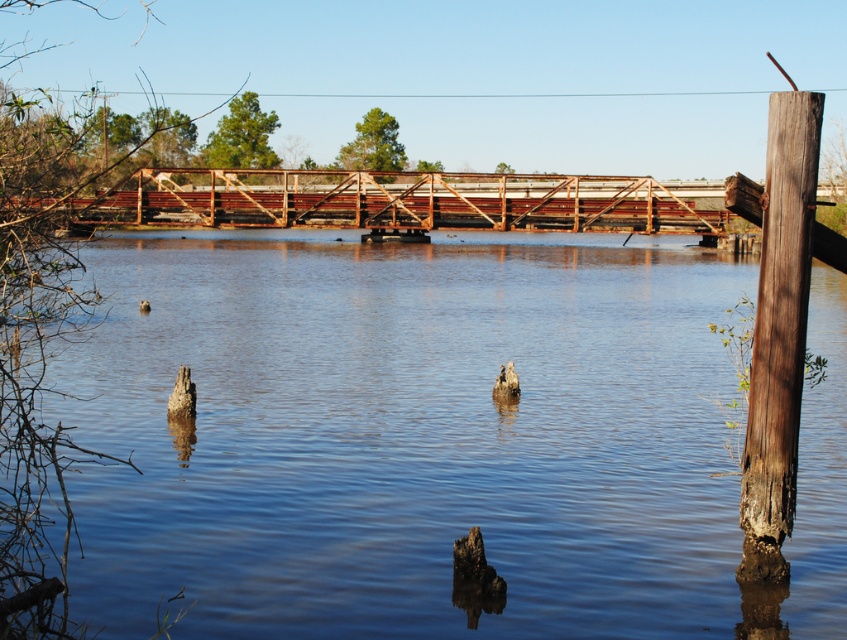
Question: Does blue water at center have a greater width compared to brown fuzzy duck at center?

Choices:
 (A) yes
 (B) no

Answer: (A)

Question: Which object appears closest to the camera in this image?

Choices:
 (A) blue water at center
 (B) brown fuzzy duck at center

Answer: (A)

Question: Can you confirm if blue water at center is positioned to the right of brown fuzzy duck at center?

Choices:
 (A) yes
 (B) no

Answer: (A)

Question: Is blue water at center below brown fuzzy duck at center?

Choices:
 (A) no
 (B) yes

Answer: (A)

Question: Which object appears closest to the camera in this image?

Choices:
 (A) brown fuzzy duck at center
 (B) blue water at center

Answer: (B)